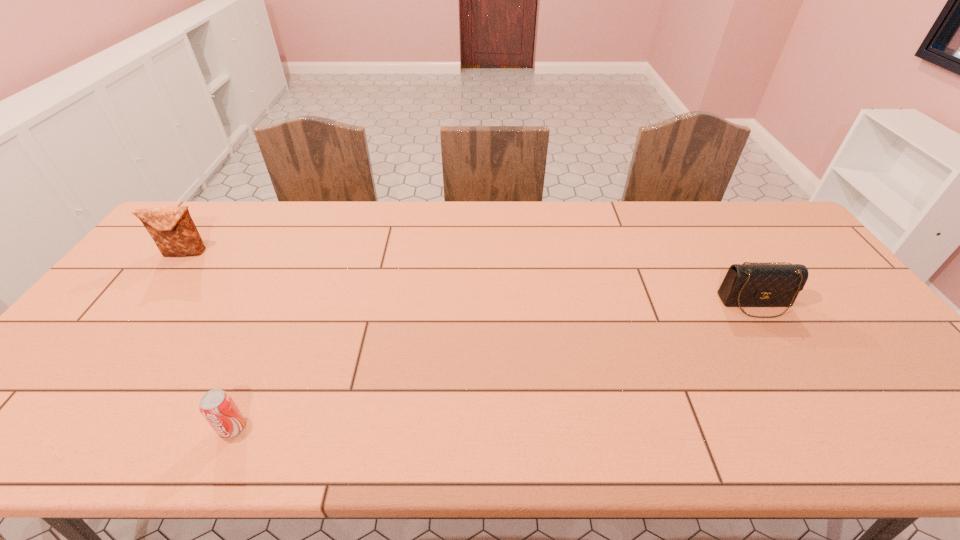
You are a GUI agent. You are given a task and a screenshot of the screen. Output one action in this format:
    pyautogui.click(x=<x>, y=<y>)
    Task: Click on the blank area at the far edge
    
    Given the screenshot: What is the action you would take?
    pyautogui.click(x=653, y=205)

Locate an element on the screen. Image resolution: width=960 pixels, height=540 pixels. vacant space at the near edge of the desktop is located at coordinates (785, 426).

Where is `vacant space at the left edge of the desktop`? vacant space at the left edge of the desktop is located at coordinates (132, 286).

The width and height of the screenshot is (960, 540). In the image, there is a desktop. Identify the location of vacant space at the right edge. (778, 247).

Locate an element on the screen. free spot at the far left corner of the desktop is located at coordinates (208, 231).

Locate an element on the screen. The image size is (960, 540). unoccupied area between the soda can and the taller clutch bag is located at coordinates (209, 340).

Locate an element on the screen. free spot between the nearest object and the nearer clutch bag is located at coordinates (494, 365).

Where is `unoccupied position between the nearest object and the nearer clutch bag`? The image size is (960, 540). unoccupied position between the nearest object and the nearer clutch bag is located at coordinates (494, 365).

At what (x,y) coordinates should I click in order to perform the action: click on vacant area that lies between the rightmost object and the second object from left to right. Please return your answer as a coordinate pair (x, y). The image size is (960, 540). Looking at the image, I should click on (494, 365).

Locate an element on the screen. Image resolution: width=960 pixels, height=540 pixels. free space between the second object from left to right and the nearer clutch bag is located at coordinates (494, 365).